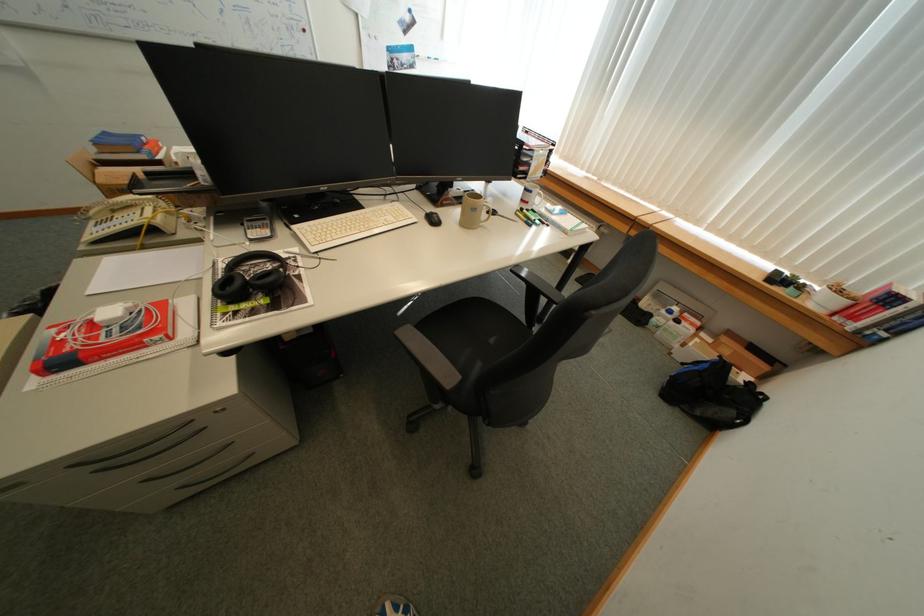
Locate an element on the screen. This screenshot has width=924, height=616. white mug handle is located at coordinates (473, 209).